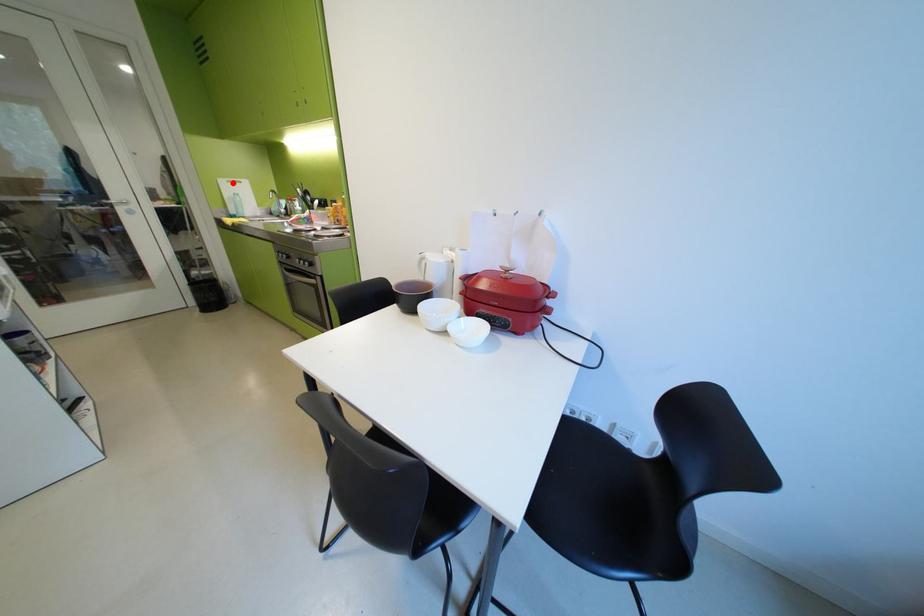
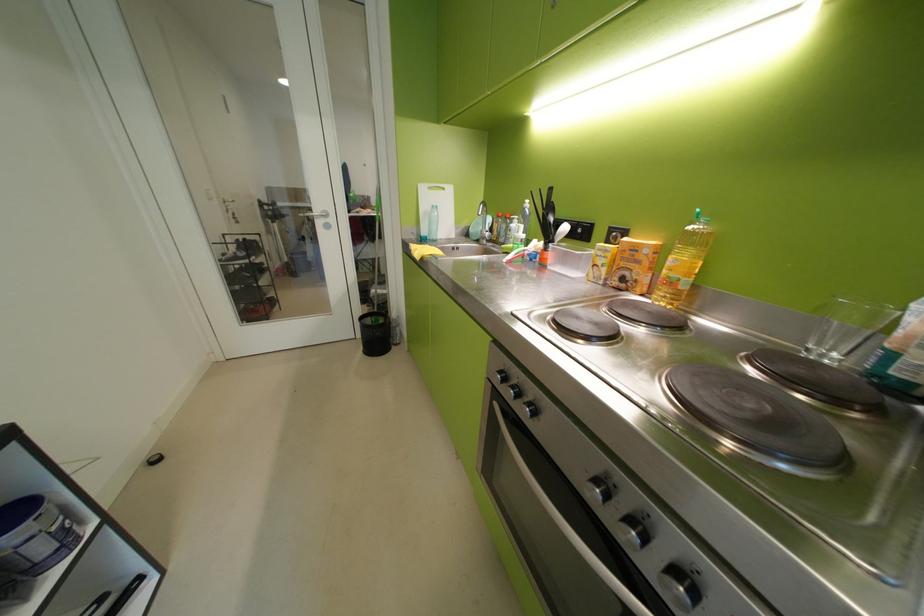
Where in the second image is the point corresponding to the highlighted location from the first image?

(433, 190)